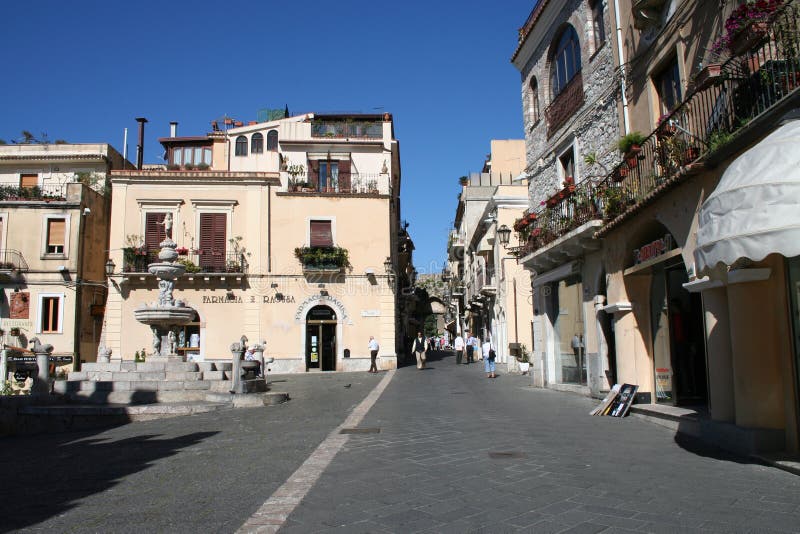
Where is `chimney`? The width and height of the screenshot is (800, 534). chimney is located at coordinates (141, 125).